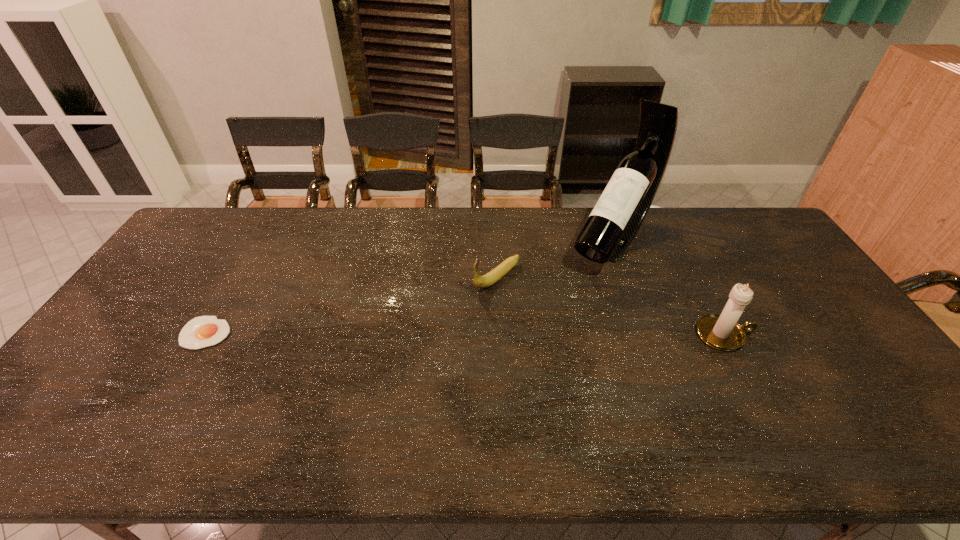
This screenshot has width=960, height=540. I want to click on the leftmost object, so click(x=203, y=331).

This screenshot has height=540, width=960. In order to click on egg yolk in this screenshot , I will do `click(203, 331)`.

In order to click on candle holder in this screenshot , I will do `click(722, 332)`.

Identify the location of banana. Image resolution: width=960 pixels, height=540 pixels. (496, 274).

You are a GUI agent. You are given a task and a screenshot of the screen. Output one action in this format:
    pyautogui.click(x=<x>, y=<y>)
    Task: Click on the second shortest object
    This screenshot has height=540, width=960.
    Given the screenshot: What is the action you would take?
    pyautogui.click(x=496, y=274)

At what (x,y) coordinates should I click in order to perform the action: click on wine bottle. Please return your answer as a coordinate pair (x, y). The image size is (960, 540). Looking at the image, I should click on (620, 211).

I want to click on free region located 0.050m on the right of the leftmost object, so click(249, 333).

I want to click on vacant space positioned 0.140m on the handle side of the second tallest object, so click(802, 335).

The width and height of the screenshot is (960, 540). Find the location of `vacant space positioned 0.350m at the stem of the second object from left to right`. vacant space positioned 0.350m at the stem of the second object from left to right is located at coordinates (389, 357).

You are a GUI agent. You are given a task and a screenshot of the screen. Output one action in this format:
    pyautogui.click(x=<x>, y=<y>)
    Task: Click on the free location located 0.390m at the stem of the second object from left to right
    
    Given the screenshot: What is the action you would take?
    pyautogui.click(x=377, y=366)